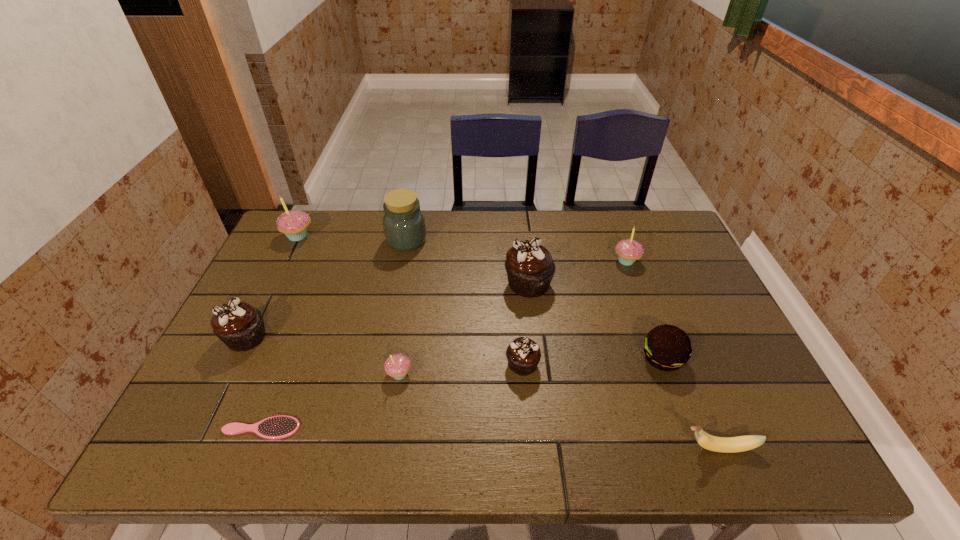
You are a GUI agent. You are given a task and a screenshot of the screen. Output one action in this format:
    pyautogui.click(x=<x>, y=<y>)
    Task: Click on the smallest brown cupcake
    
    Given the screenshot: What is the action you would take?
    pyautogui.click(x=523, y=354)

You are a GUI agent. You are given a task and a screenshot of the screen. Output one action in this format:
    pyautogui.click(x=<x>, y=<y>)
    Task: Click on the yellow banana
    
    Given the screenshot: What is the action you would take?
    pyautogui.click(x=740, y=443)

At what (x,y) coordinates should I click in order to perform the action: click on banana. Please return your answer as a coordinate pair (x, y). The height and width of the screenshot is (540, 960). Looking at the image, I should click on (740, 443).

Where is `the shortest object`? the shortest object is located at coordinates (275, 427).

Locate an element on the screen. This screenshot has height=540, width=960. hairbrush is located at coordinates (275, 427).

The height and width of the screenshot is (540, 960). What are the coordinates of `vacant space positioned 0.310m on the left of the jar` in the screenshot? It's located at pyautogui.click(x=293, y=240).

This screenshot has width=960, height=540. I want to click on free location located on the left of the farthest brown cupcake, so click(446, 284).

At what (x,y) coordinates should I click in order to perform the action: click on free location located 0.070m on the right of the farthest pink cupcake. Please return your answer as a coordinate pair (x, y). The height and width of the screenshot is (540, 960). Looking at the image, I should click on (335, 236).

In order to click on free space located 0.360m on the right of the leftmost brown cupcake in this screenshot , I will do `click(405, 338)`.

Locate an element on the screen. free space located on the front of the rightmost pink cupcake is located at coordinates (660, 352).